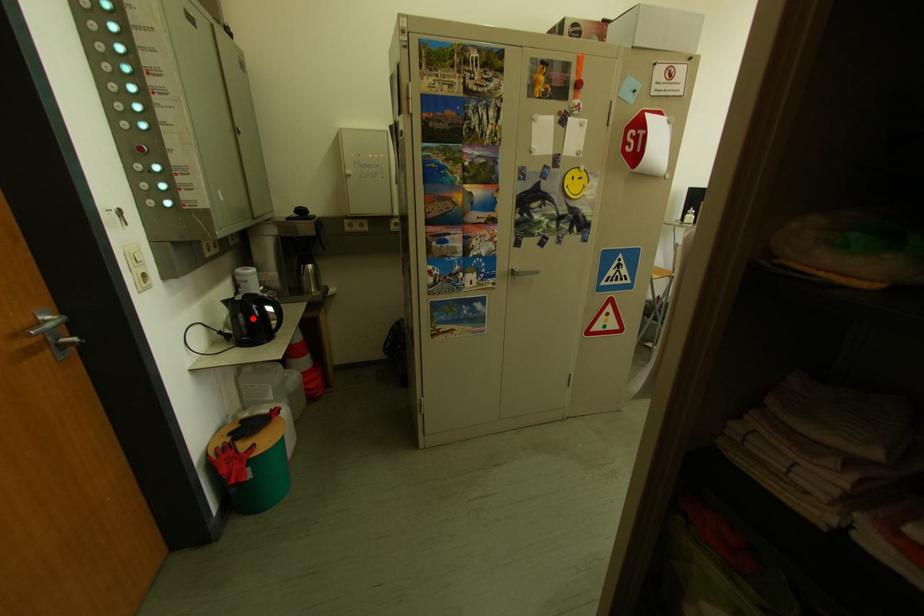
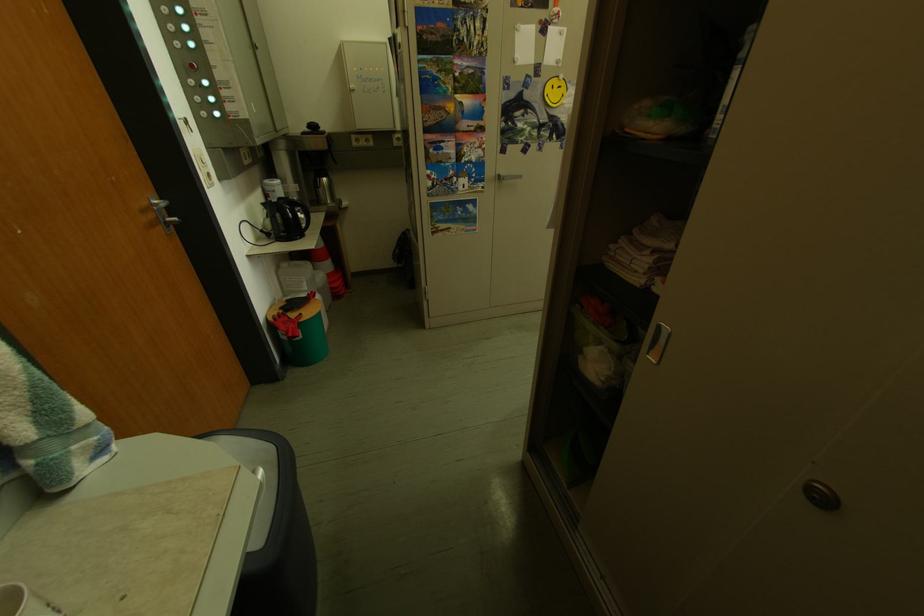
Locate, in the second image, the point that corresponds to the highlighted location in the first image.

(290, 217)